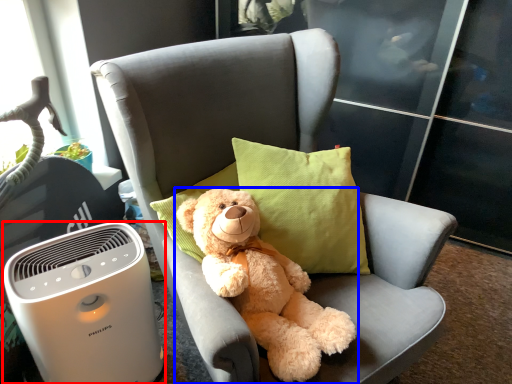
Question: Which point is further to the camera, home appliance (highlighted by a red box) or teddy bear (highlighted by a blue box)?

Choices:
 (A) home appliance
 (B) teddy bear

Answer: (A)